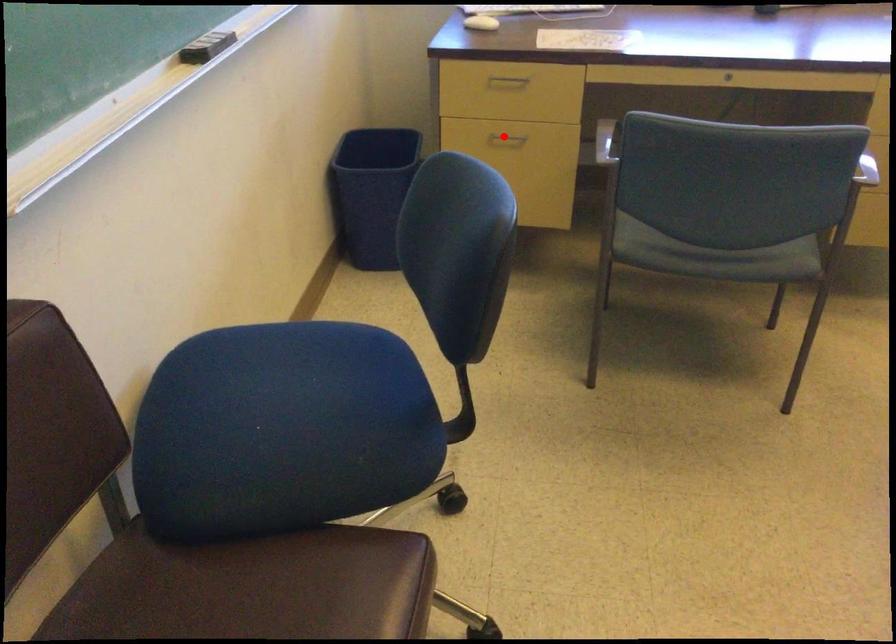
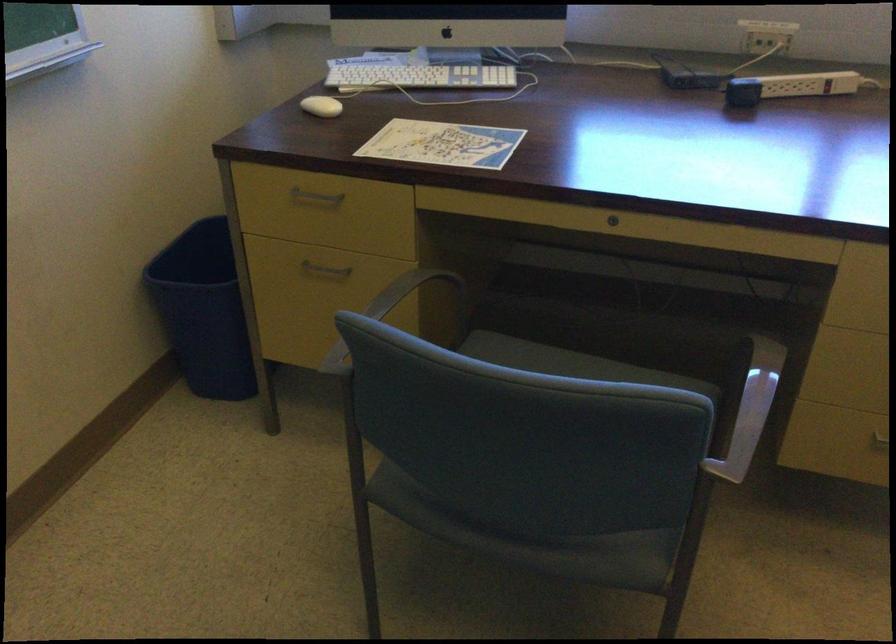
Where in the second image is the point corresponding to the highlighted location from the first image?

(324, 269)